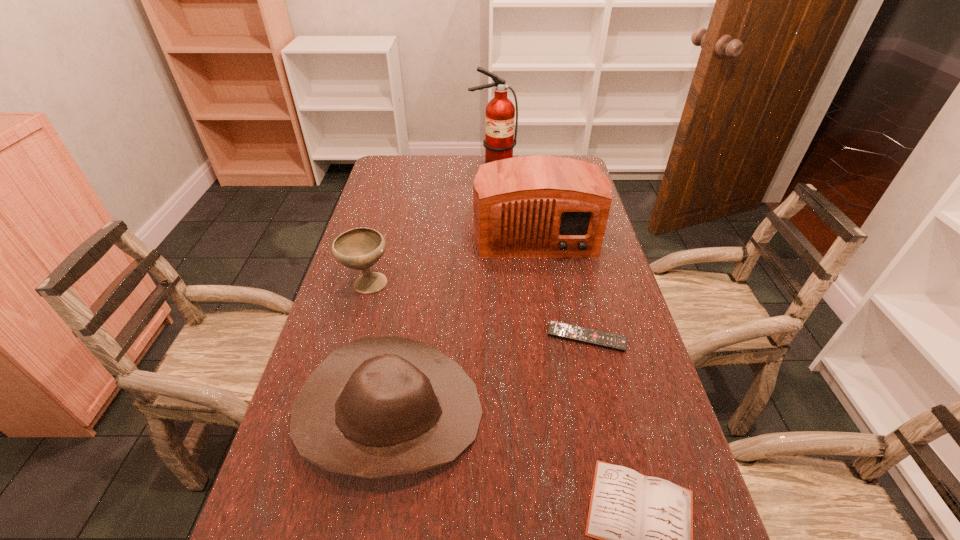
Where is `fire extinguisher`? fire extinguisher is located at coordinates (499, 141).

You are a GUI agent. You are given a task and a screenshot of the screen. Output one action in this format:
    pyautogui.click(x=<x>, y=<y>)
    Task: Click on the farthest object
    
    Given the screenshot: What is the action you would take?
    pyautogui.click(x=499, y=141)

You are a GUI agent. You are given a task and a screenshot of the screen. Output one action in this format:
    pyautogui.click(x=<x>, y=<y>)
    Task: Click on the second farthest object
    The width and height of the screenshot is (960, 540).
    Given the screenshot: What is the action you would take?
    pyautogui.click(x=539, y=206)

Find the location of a particular element. The width and height of the screenshot is (960, 540). radio receiver is located at coordinates (539, 206).

This screenshot has height=540, width=960. In order to click on the fourth nearest object in this screenshot , I will do `click(360, 248)`.

Where is `cowboy hat`? Image resolution: width=960 pixels, height=540 pixels. cowboy hat is located at coordinates (379, 406).

This screenshot has width=960, height=540. What are the coordinates of `remote control` in the screenshot? It's located at (617, 342).

Image resolution: width=960 pixels, height=540 pixels. What are the coordinates of `free space located 0.190m on the nozzle and handle of the tallest object` in the screenshot? It's located at (494, 196).

This screenshot has height=540, width=960. Identify the location of free space located 0.160m on the front-facing side of the second tallest object. (546, 302).

Where is `free space located on the front of the fourth nearest object`? free space located on the front of the fourth nearest object is located at coordinates pyautogui.click(x=336, y=397).